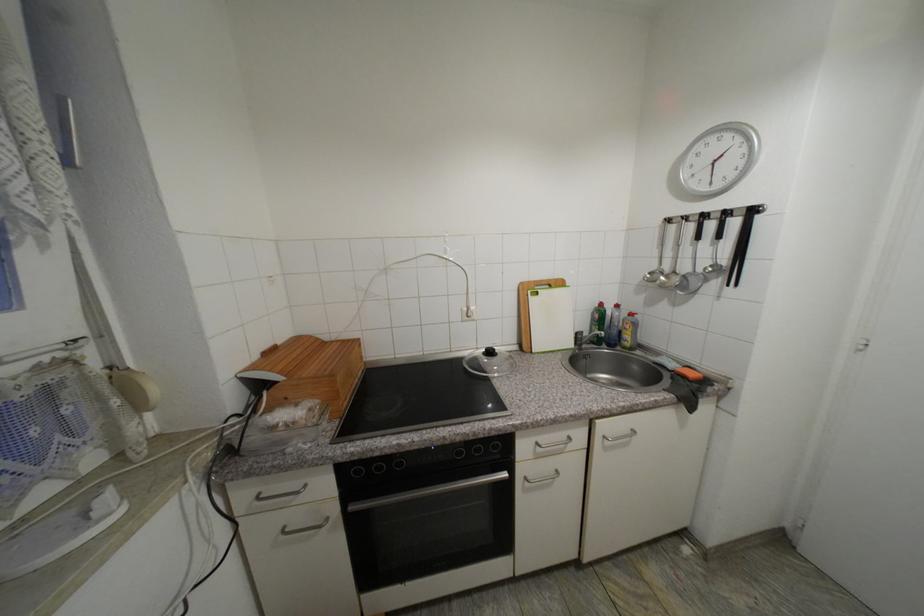
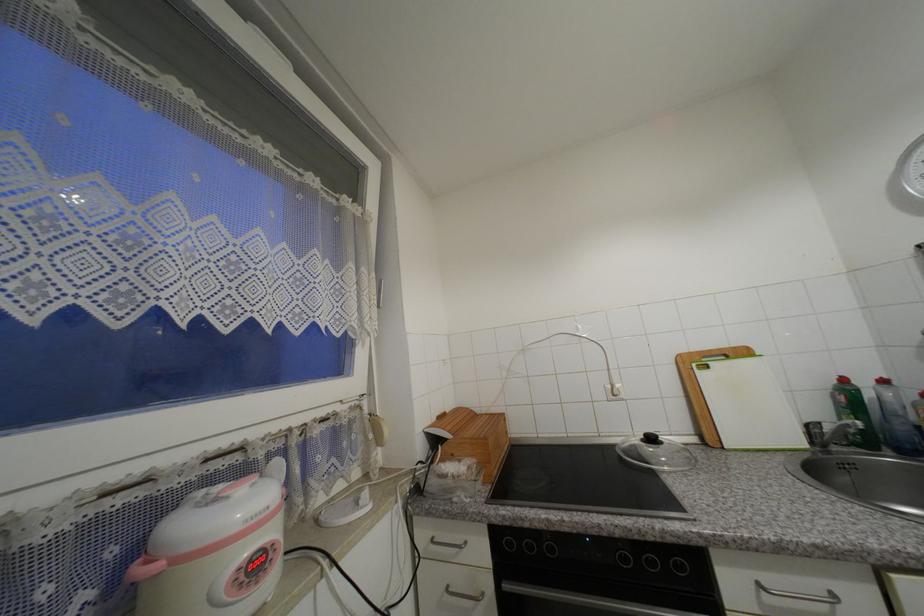
Where in the second image is the point corresponding to the point at 606,306 from the first image?

(849, 381)